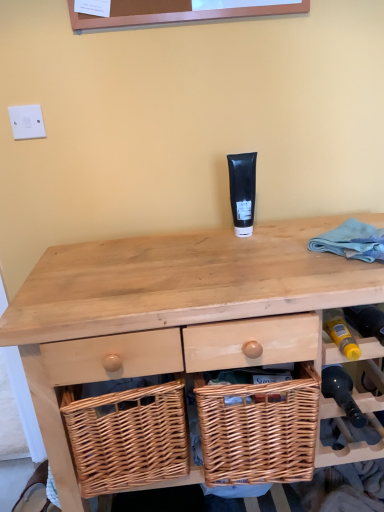
Question: Based on their positions, is white plastic switch at upper left located to the left or right of natural wood desk at center?

Choices:
 (A) right
 (B) left

Answer: (B)

Question: Based on their sizes in the image, would you say white plastic switch at upper left is bigger or smaller than natural wood desk at center?

Choices:
 (A) big
 (B) small

Answer: (B)

Question: Which is farther from the natural wood desk at center?

Choices:
 (A) woven wood basket at lower center
 (B) woven wood picnic basket at center
 (C) black matte tube at center
 (D) wooden wicker basket at lower right
 (E) white plastic switch at upper left

Answer: (E)

Question: Which of these objects is positioned farthest from the woven wood basket at lower center?

Choices:
 (A) black matte tube at center
 (B) woven wood picnic basket at center
 (C) natural wood desk at center
 (D) wooden wicker basket at lower right
 (E) white plastic switch at upper left

Answer: (E)